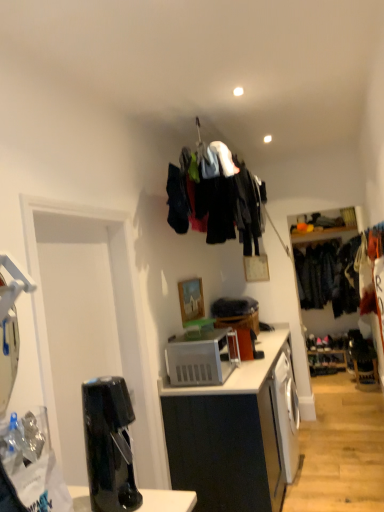
Question: Can you confirm if dark blue fabric at right, positioned as the first clothing in back-to-front order, is smaller than white matte cabinet at center?

Choices:
 (A) yes
 (B) no

Answer: (A)

Question: Is dark blue fabric at right, the second clothing positioned from the left, at the right side of white matte cabinet at center?

Choices:
 (A) no
 (B) yes

Answer: (B)

Question: Are dark blue fabric at right, the 2th clothing in the front-to-back sequence, and white matte cabinet at center beside each other?

Choices:
 (A) yes
 (B) no

Answer: (B)

Question: Considering the relative sizes of dark blue fabric at right, which is the first clothing from right to left, and white matte cabinet at center in the image provided, is dark blue fabric at right, which is the first clothing from right to left, taller than white matte cabinet at center?

Choices:
 (A) yes
 (B) no

Answer: (A)

Question: Is dark blue fabric at right, positioned as the first clothing in back-to-front order, turned away from white matte cabinet at center?

Choices:
 (A) yes
 (B) no

Answer: (B)

Question: Is dark blue fabric at right, the 2th clothing in the front-to-back sequence, taller or shorter than wooden picture frame at center?

Choices:
 (A) short
 (B) tall

Answer: (B)

Question: Looking at the image, does dark blue fabric at right, the second clothing positioned from the left, seem bigger or smaller compared to wooden picture frame at center?

Choices:
 (A) big
 (B) small

Answer: (A)

Question: Is point (296, 271) closer or farther from the camera than point (182, 314)?

Choices:
 (A) closer
 (B) farther

Answer: (B)

Question: Is dark blue fabric at right, positioned as the first clothing in back-to-front order, spatially inside wooden picture frame at center, or outside of it?

Choices:
 (A) inside
 (B) outside

Answer: (B)

Question: Considering the positions of point (193, 353) and point (94, 388), is point (193, 353) closer or farther from the camera than point (94, 388)?

Choices:
 (A) closer
 (B) farther

Answer: (B)

Question: From the image's perspective, is white plastic microwave oven at center above or below black glossy coffee machine at lower left?

Choices:
 (A) above
 (B) below

Answer: (B)

Question: Based on their positions, is white plastic microwave oven at center located to the left or right of black glossy coffee machine at lower left?

Choices:
 (A) left
 (B) right

Answer: (B)

Question: From a real-world perspective, relative to black glossy coffee machine at lower left, is white plastic microwave oven at center vertically above or below?

Choices:
 (A) below
 (B) above

Answer: (A)

Question: Is dark blue fabric at right, the second clothing positioned from the left, in front of or behind black glossy coffee machine at lower left in the image?

Choices:
 (A) behind
 (B) front

Answer: (A)

Question: Looking at their shapes, would you say dark blue fabric at right, positioned as the first clothing in back-to-front order, is wider or thinner than black glossy coffee machine at lower left?

Choices:
 (A) wide
 (B) thin

Answer: (A)